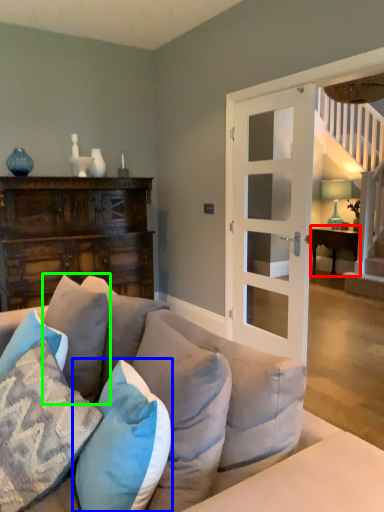
Question: Which object is the closest to the table (highlighted by a red box)? Choose among these: pillow (highlighted by a blue box) or pillow (highlighted by a green box).

Choices:
 (A) pillow
 (B) pillow

Answer: (B)